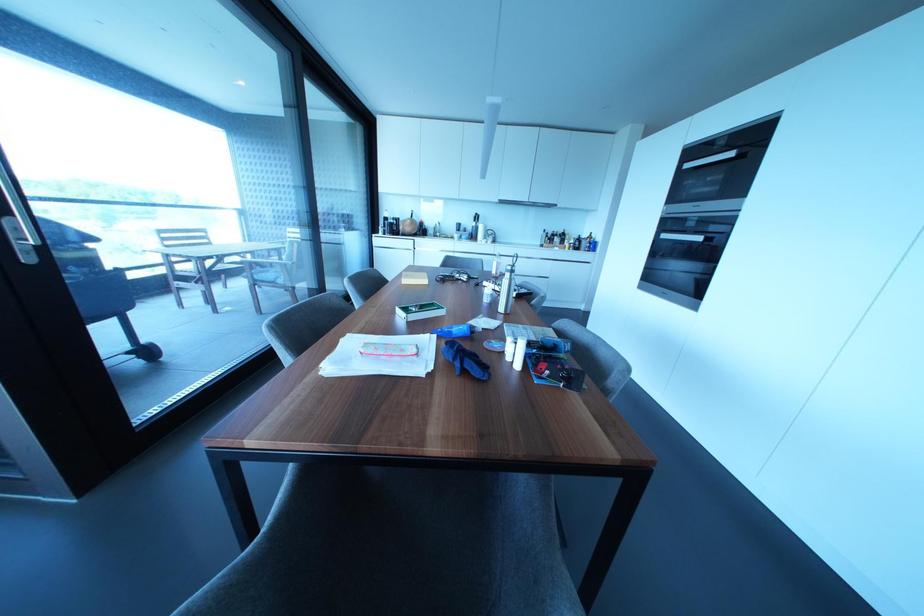
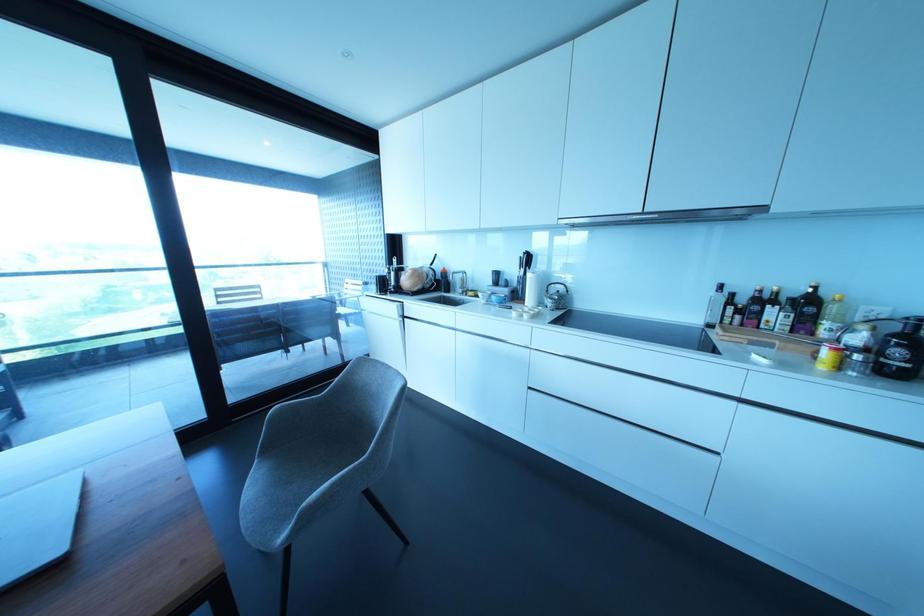
In the second image, find the point that corresponds to pixel 463 236 in the first image.

(492, 297)